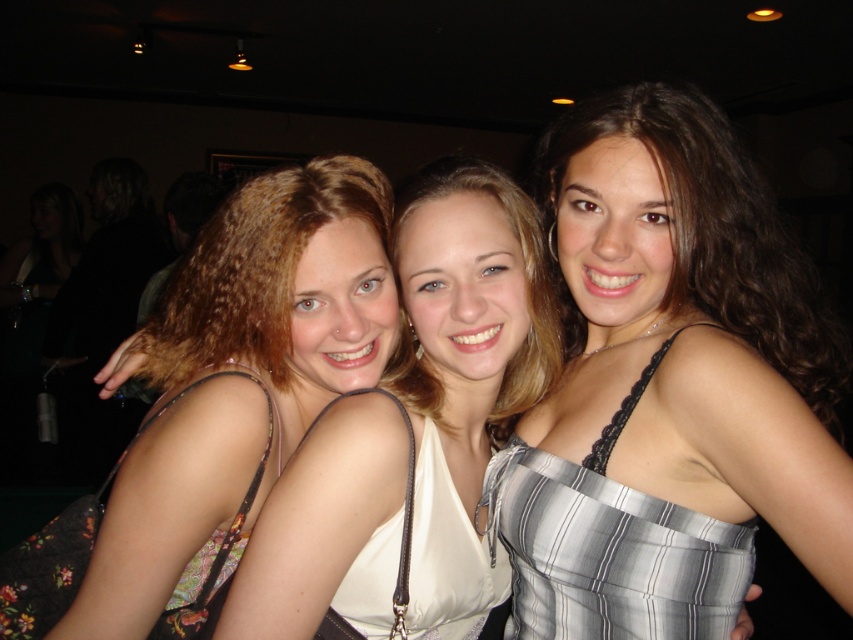
You are trying to locate the silver striped dress at center in the image. According to the coordinates provided, where exactly is it positioned?

The silver striped dress at center is located at point 0.603 on the x axis and 0.787 on the y axis.

You are a photographer trying to adjust the lighting for a photo shoot. You notice two dresses in the scene, the matte floral dress at center and the striped satin dress at center. Which dress should you focus your spotlight on if you want to highlight the one closer to the camera?

The matte floral dress at center is closer to the camera than the striped satin dress at center, so you should focus the spotlight on the matte floral dress at center.